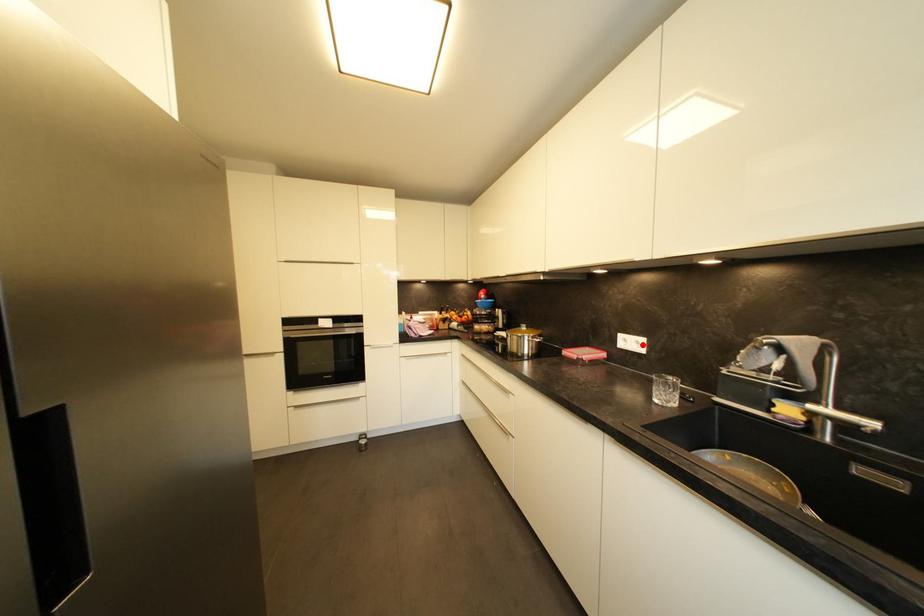
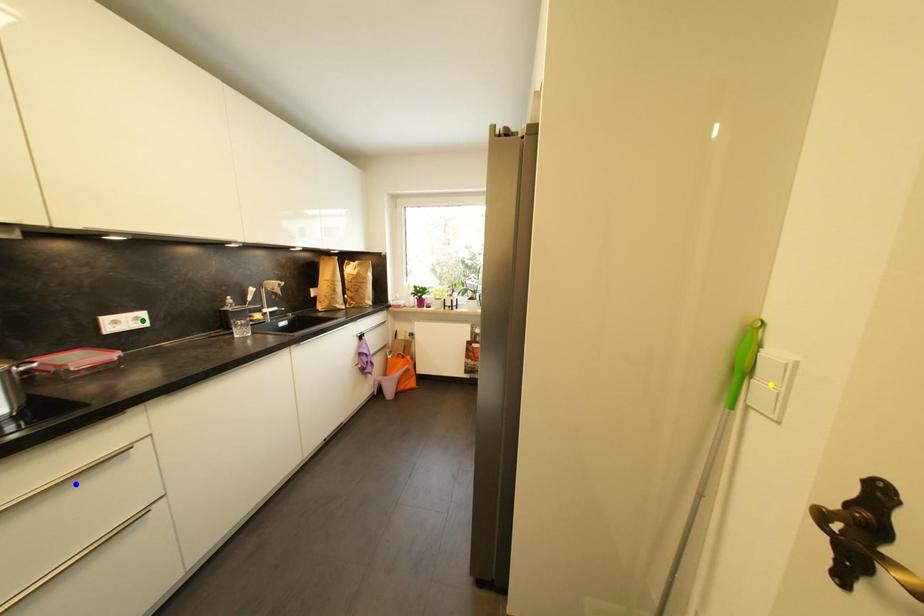
Question: I am providing you with two images of the same scene from different viewpoints. A red point is marked on the first image. You are given multiple points on the second image. Which spot in image 2 lines up with the point in image 1?

Choices:
 (A) yellow point
 (B) blue point
 (C) green point

Answer: (C)